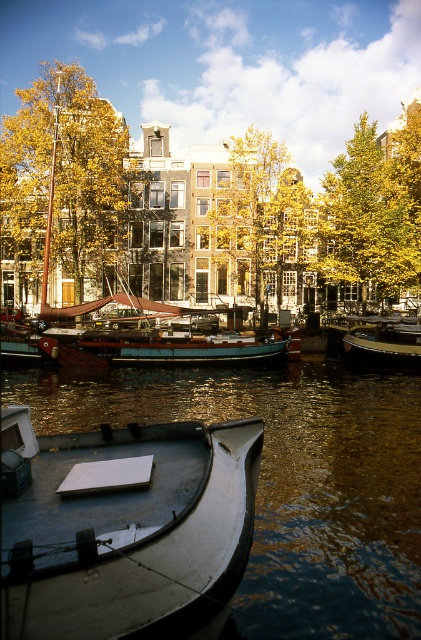
Question: Is metallic gray boat at lower left to the right of yellow/golden leaves at center from the viewer's perspective?

Choices:
 (A) no
 (B) yes

Answer: (A)

Question: Which point is closer to the camera taking this photo?

Choices:
 (A) (300, 184)
 (B) (210, 582)
 (C) (410, 362)

Answer: (B)

Question: Considering the relative positions of yellow/golden leaves at upper center and shiny silver boat at center in the image provided, where is yellow/golden leaves at upper center located with respect to shiny silver boat at center?

Choices:
 (A) left
 (B) right

Answer: (B)

Question: Among these points, which one is farthest from the camera?

Choices:
 (A) click(413, 237)
 (B) click(253, 208)
 (C) click(399, 360)
 (D) click(71, 476)

Answer: (B)

Question: Which object appears closest to the camera in this image?

Choices:
 (A) metallic gray boat at lower left
 (B) white matte dock at center
 (C) shiny silver boat at center
 (D) yellow/golden leaves at upper center

Answer: (A)

Question: Can you confirm if yellow/golden leaves at center is positioned to the left of shiny silver boat at center?

Choices:
 (A) yes
 (B) no

Answer: (A)